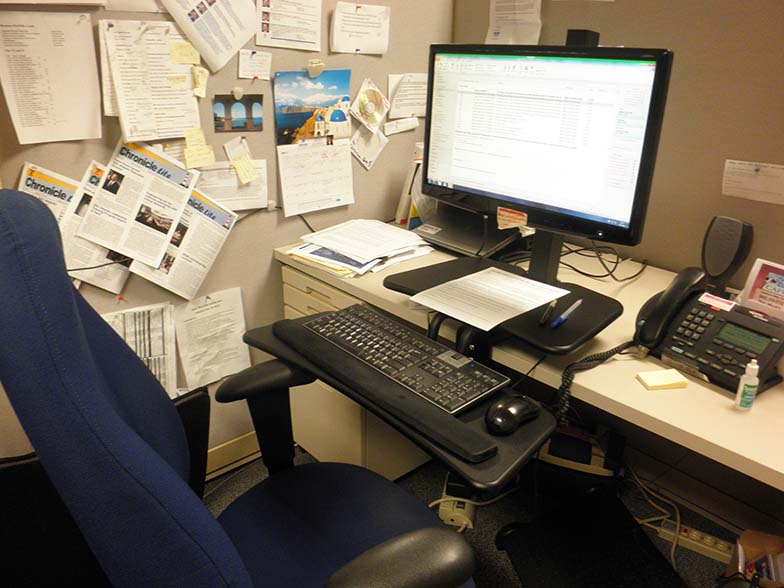
You are a GUI agent. You are given a task and a screenshot of the screen. Output one action in this format:
    pyautogui.click(x=<x>, y=<y>)
    Task: Click on the desk
    
    Given the screenshot: What is the action you would take?
    pyautogui.click(x=672, y=417)